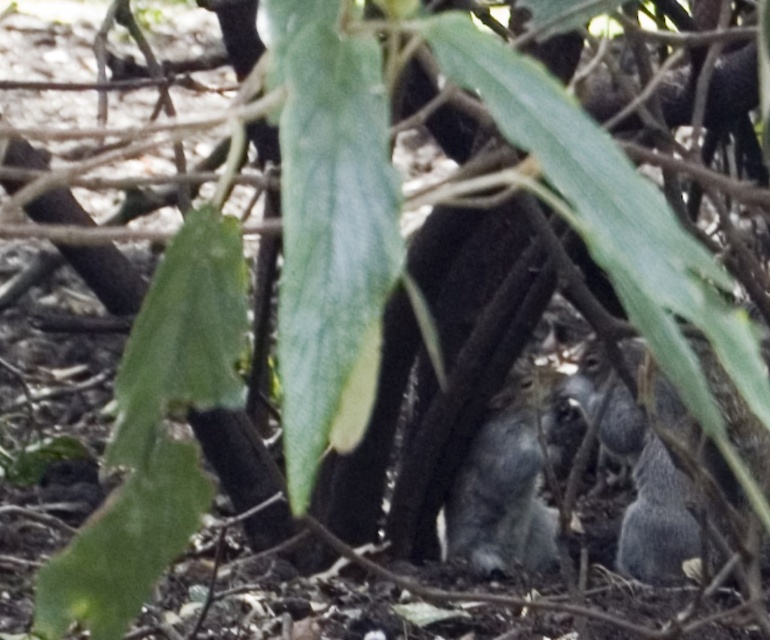
Question: Which object appears farthest from the camera in this image?

Choices:
 (A) gray furry squirrel at center
 (B) gray furry squirrel at lower right

Answer: (A)

Question: Is gray furry squirrel at lower right closer to camera compared to gray furry squirrel at center?

Choices:
 (A) yes
 (B) no

Answer: (A)

Question: Can you confirm if gray furry squirrel at lower right is positioned above gray furry squirrel at center?

Choices:
 (A) yes
 (B) no

Answer: (A)

Question: Among these points, which one is farthest from the camera?

Choices:
 (A) (638, 413)
 (B) (504, 502)

Answer: (A)

Question: Which point is closer to the camera taking this photo?

Choices:
 (A) (658, 387)
 (B) (511, 424)

Answer: (A)

Question: Is gray furry squirrel at lower right smaller than gray furry squirrel at center?

Choices:
 (A) no
 (B) yes

Answer: (A)